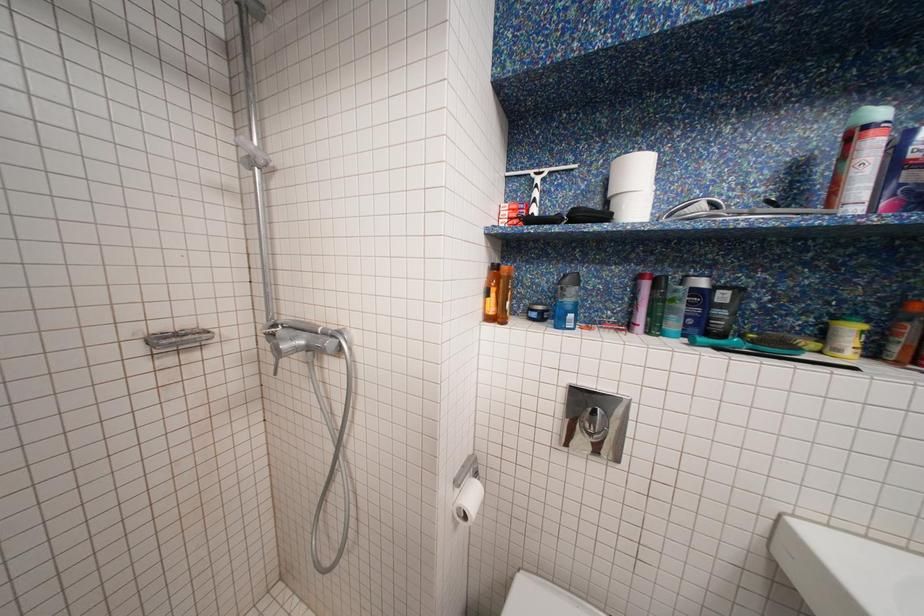
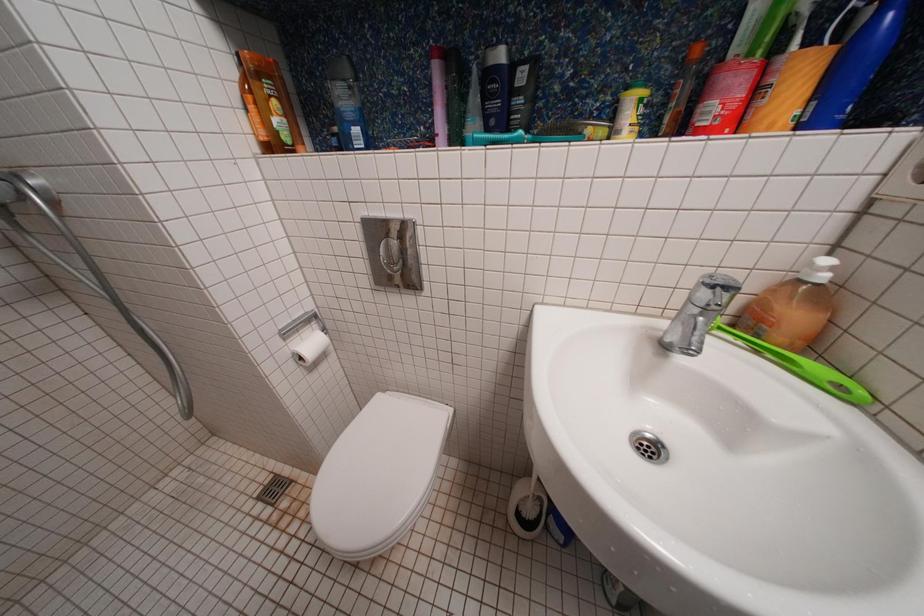
Question: The images are taken continuously from a first-person perspective. In which direction are you moving?

Choices:
 (A) Left
 (B) Right
 (C) Forward
 (D) Backward

Answer: (B)